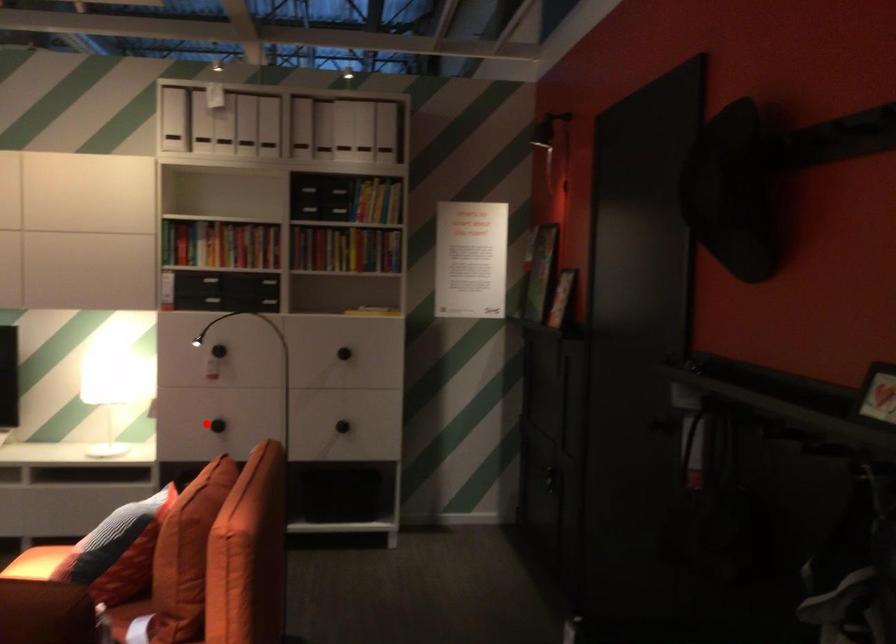
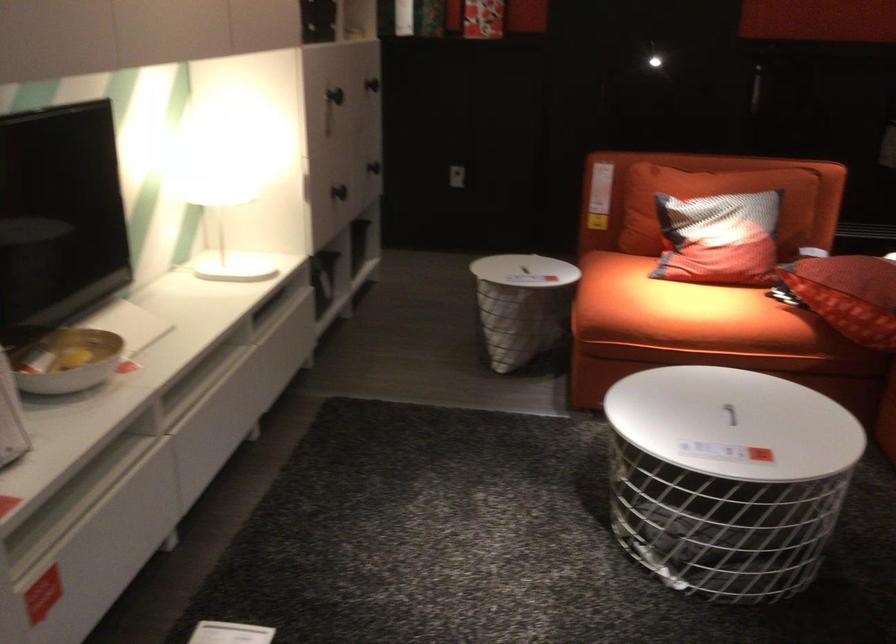
The point at the highlighted location is marked in the first image. Where is the corresponding point in the second image?

(339, 192)